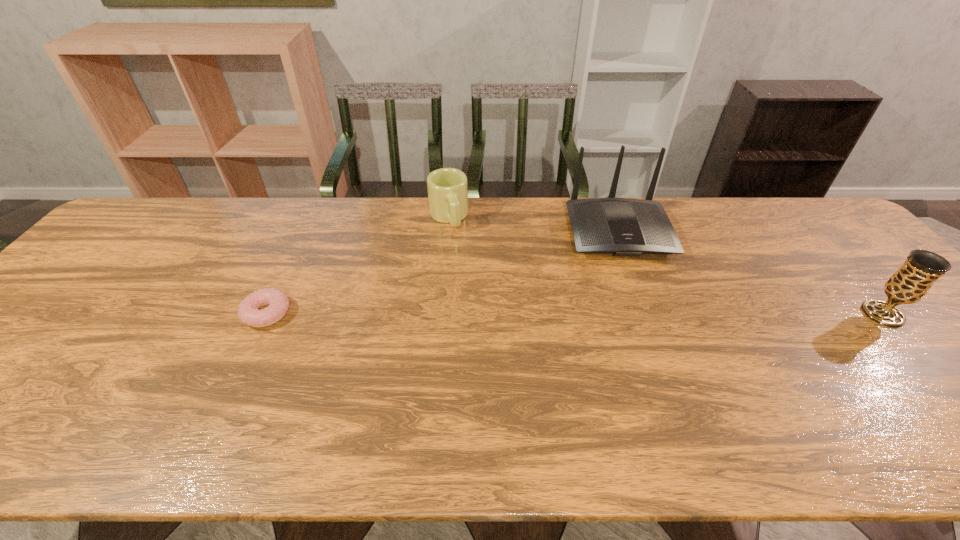
At what (x,y) coordinates should I click in order to perform the action: click on the leftmost object. Please return your answer as a coordinate pair (x, y). This screenshot has height=540, width=960. Looking at the image, I should click on (248, 312).

Locate an element on the screen. the shortest object is located at coordinates (248, 312).

This screenshot has width=960, height=540. In order to click on chalice in this screenshot , I will do `click(911, 282)`.

I want to click on the rightmost object, so pyautogui.click(x=911, y=282).

The width and height of the screenshot is (960, 540). Find the location of `mug`. mug is located at coordinates (447, 188).

This screenshot has height=540, width=960. Find the location of `the second object from left to right`. the second object from left to right is located at coordinates (447, 188).

In order to click on the tallest object in this screenshot , I will do `click(620, 226)`.

Identify the location of the third object from left to right. (620, 226).

The height and width of the screenshot is (540, 960). I want to click on vacant space positioned 0.050m on the front of the doughnut, so click(x=251, y=348).

I want to click on vacant area situated on the back of the rightmost object, so click(x=810, y=233).